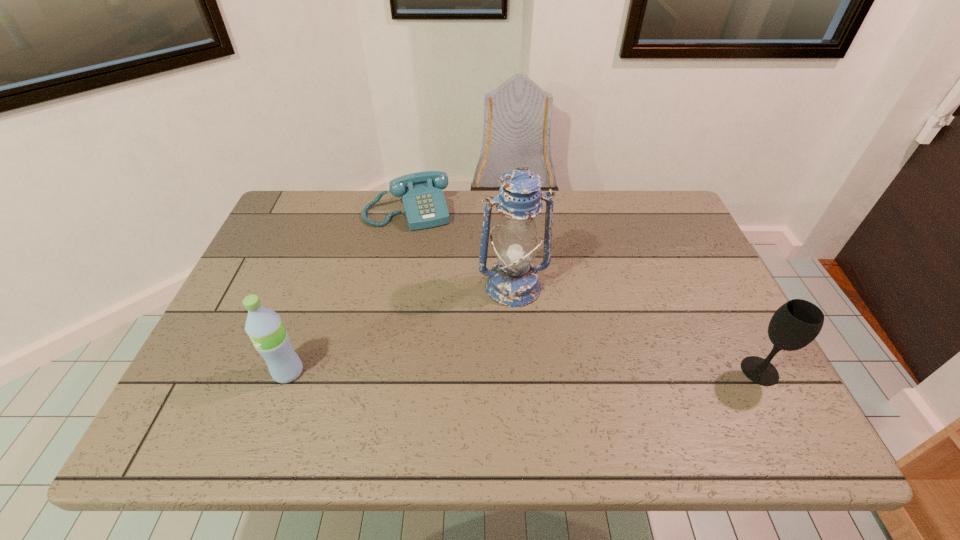
Locate an element on the screen. object that is at the near right corner is located at coordinates (795, 324).

The image size is (960, 540). I want to click on vacant area at the far edge, so click(592, 194).

At what (x,y) coordinates should I click in order to perform the action: click on vacant position at the near edge of the desktop. Please return your answer as a coordinate pair (x, y). This screenshot has height=540, width=960. Looking at the image, I should click on (471, 399).

Where is `free space at the left edge`? Image resolution: width=960 pixels, height=540 pixels. free space at the left edge is located at coordinates (293, 247).

At what (x,y) coordinates should I click in order to perform the action: click on free region at the right edge of the desktop. Please return your answer as a coordinate pair (x, y). The image size is (960, 540). Looking at the image, I should click on (673, 244).

The width and height of the screenshot is (960, 540). In order to click on vacant space at the far left corner in this screenshot , I will do `click(330, 209)`.

Find the location of a particular element. The width and height of the screenshot is (960, 540). free space at the near left corner of the desktop is located at coordinates (196, 373).

In the image, there is a desktop. At what (x,y) coordinates should I click in order to perform the action: click on vacant space at the far right corner. Please return your answer as a coordinate pair (x, y). The image size is (960, 540). Looking at the image, I should click on (626, 197).

Where is `free space between the second shortest object and the second object from right to left`? free space between the second shortest object and the second object from right to left is located at coordinates (636, 329).

Image resolution: width=960 pixels, height=540 pixels. Find the location of `vacant area that lies between the lantern and the rightmost object`. vacant area that lies between the lantern and the rightmost object is located at coordinates (636, 329).